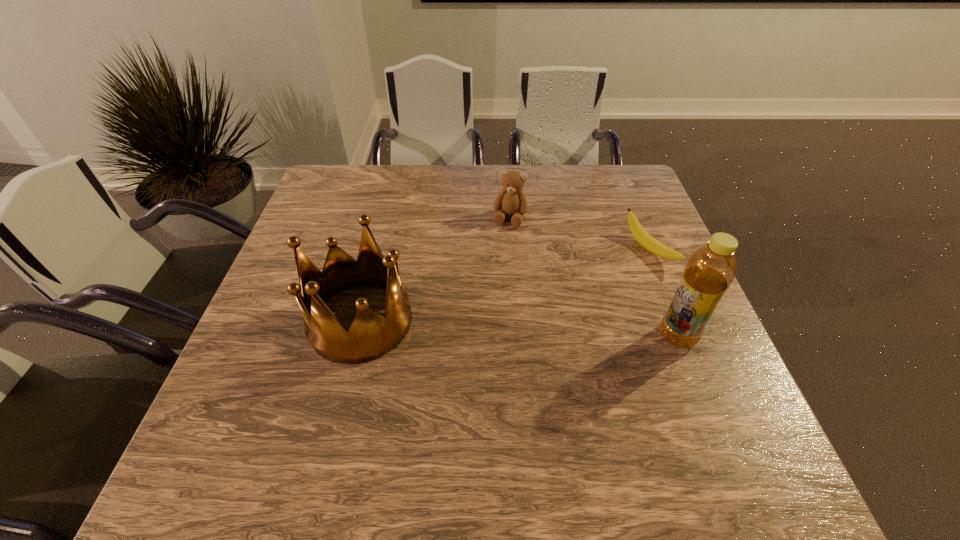
You are a GUI agent. You are given a task and a screenshot of the screen. Output one action in this format:
    pyautogui.click(x=<x>, y=<y>)
    Task: Click on the free spot at the left edge of the desktop
    This screenshot has width=960, height=540.
    Given the screenshot: What is the action you would take?
    pyautogui.click(x=279, y=368)

The width and height of the screenshot is (960, 540). What are the coordinates of `free point at the right edge` in the screenshot? It's located at (640, 220).

In the image, there is a desktop. At what (x,y) coordinates should I click in order to perform the action: click on vacant space at the far left corner. Please return your answer as a coordinate pair (x, y). The image size is (960, 540). Looking at the image, I should click on (340, 166).

You are a GUI agent. You are given a task and a screenshot of the screen. Output one action in this format:
    pyautogui.click(x=<x>, y=<y>)
    Task: Click on the free space at the far right corner of the desktop
    The height and width of the screenshot is (540, 960).
    Given the screenshot: What is the action you would take?
    pyautogui.click(x=642, y=196)

Identify the location of vacant area that lies between the second tallest object and the banana. (505, 285).

Identify the location of free spot between the leftmost object and the shortest object. (505, 285).

The height and width of the screenshot is (540, 960). I want to click on vacant space that is in between the leftmost object and the tallest object, so click(x=518, y=329).

Where is `free space between the leftmost object and the banana`? The height and width of the screenshot is (540, 960). free space between the leftmost object and the banana is located at coordinates (505, 285).

Locate an element on the screen. The height and width of the screenshot is (540, 960). empty space that is in between the third tallest object and the bottle is located at coordinates (593, 277).

You are a GUI agent. You are given a task and a screenshot of the screen. Output one action in this format:
    pyautogui.click(x=<x>, y=<y>)
    Task: Click on the free space between the second object from left to right and the shortest object
    This screenshot has width=960, height=540.
    Given the screenshot: What is the action you would take?
    pyautogui.click(x=580, y=234)